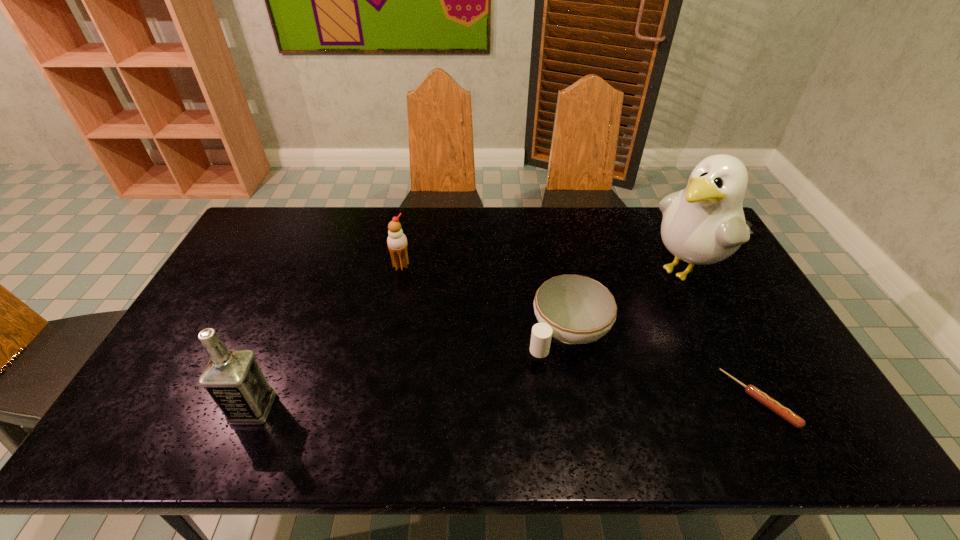
The height and width of the screenshot is (540, 960). I want to click on vacant region at the left edge, so click(x=189, y=363).

Where is `vacant area at the right edge of the desktop`? The image size is (960, 540). vacant area at the right edge of the desktop is located at coordinates (743, 294).

Locate an element on the screen. vacant space at the far left corner of the desktop is located at coordinates (276, 217).

At what (x,y) coordinates should I click in order to perform the action: click on free space at the near right corner. Please return your answer as a coordinate pair (x, y). Looking at the image, I should click on (751, 382).

Locate an element on the screen. The height and width of the screenshot is (540, 960). vacant space in between the shortest object and the second tallest object is located at coordinates (506, 403).

The width and height of the screenshot is (960, 540). Identify the location of free spot between the gull and the leftmost object. (470, 339).

You are a GUI agent. You are given a task and a screenshot of the screen. Output one action in this format:
    pyautogui.click(x=<x>, y=<y>)
    Task: Click on the free space between the shortest object and the gull
    Image resolution: width=960 pixels, height=540 pixels.
    Given the screenshot: What is the action you would take?
    pyautogui.click(x=724, y=335)

Image resolution: width=960 pixels, height=540 pixels. I want to click on free space between the gull and the second shortest object, so click(628, 301).

This screenshot has height=540, width=960. Find the location of `unoccupied position between the fourth tallest object and the tallest object`. unoccupied position between the fourth tallest object and the tallest object is located at coordinates (628, 301).

What are the coordinates of `free space between the fourth object from right to left and the third object from right to left` in the screenshot? It's located at (484, 299).